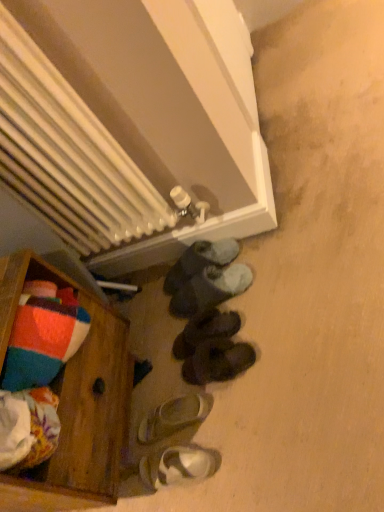
I want to click on vacant space situated on the left part of black suede shoes at lower center, which is the 3th footwear from bottom to top, so click(164, 392).